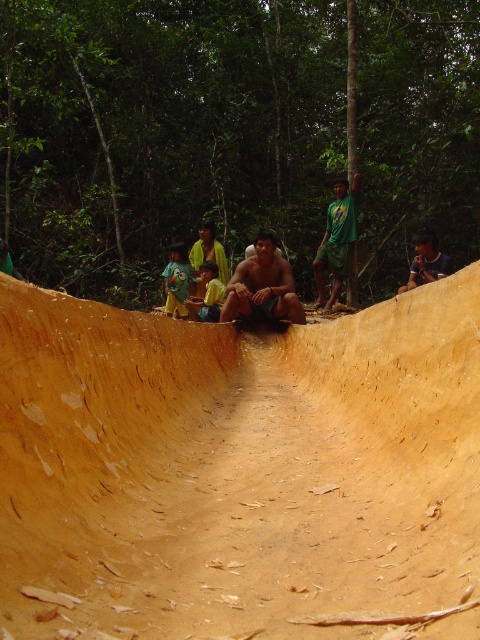
You are a photographer standing at the bottom of the slide. You want to take a photo of the brown wood man at center and the yellow shirt at center so that both are clearly visible. Which object should you focus on first to ensure proper focus, considering their sizes?

The brown wood man at center has a greater height compared to the yellow shirt at center, so you should focus on the brown wood man at center first to ensure proper focus since it is larger and more prominent in the frame.